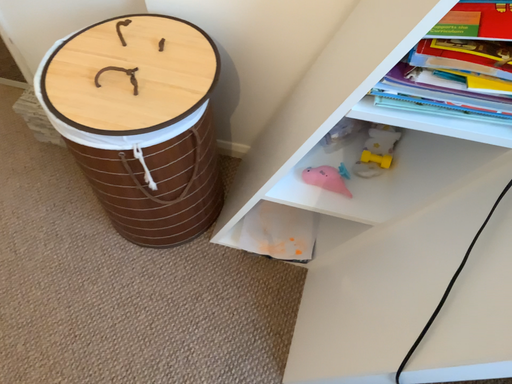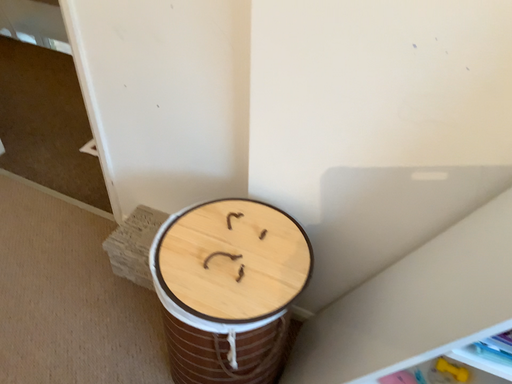
Question: Which way did the camera rotate in the video?

Choices:
 (A) rotated upward
 (B) rotated downward

Answer: (A)